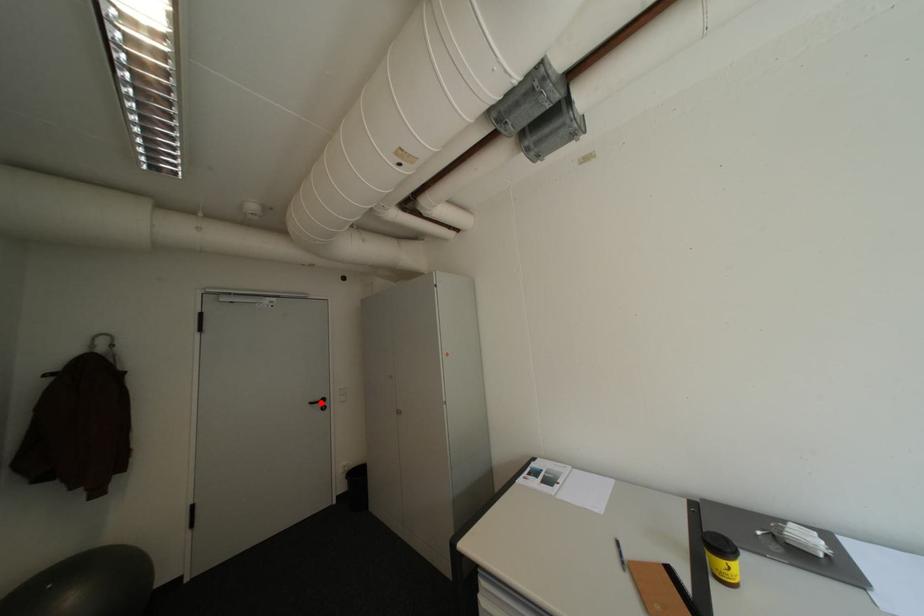
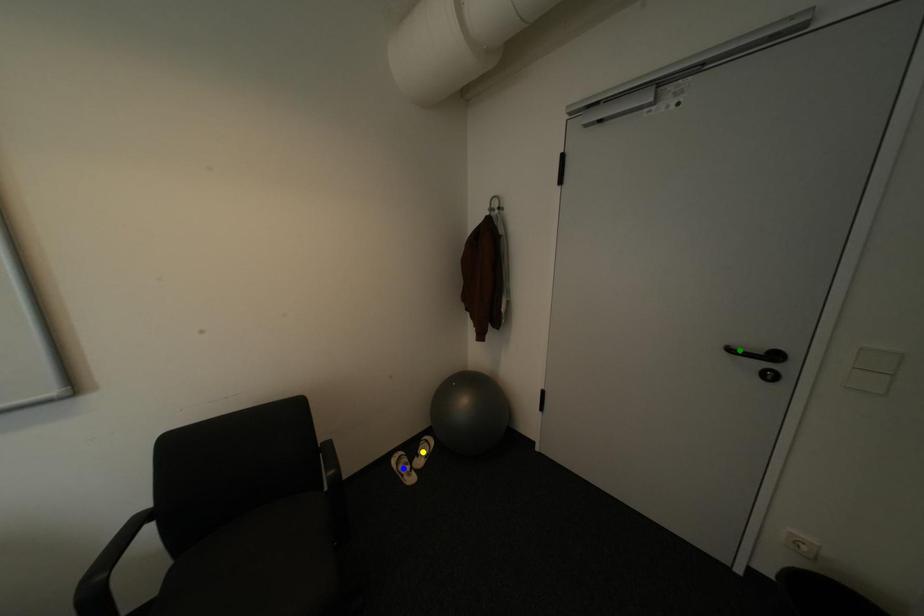
Question: I am providing you with two images of the same scene from different viewpoints. A red point is marked on the first image. You are given multiple points on the second image. Which mark in image 2 goes with the point in image 1?

Choices:
 (A) yellow point
 (B) green point
 (C) blue point

Answer: (B)